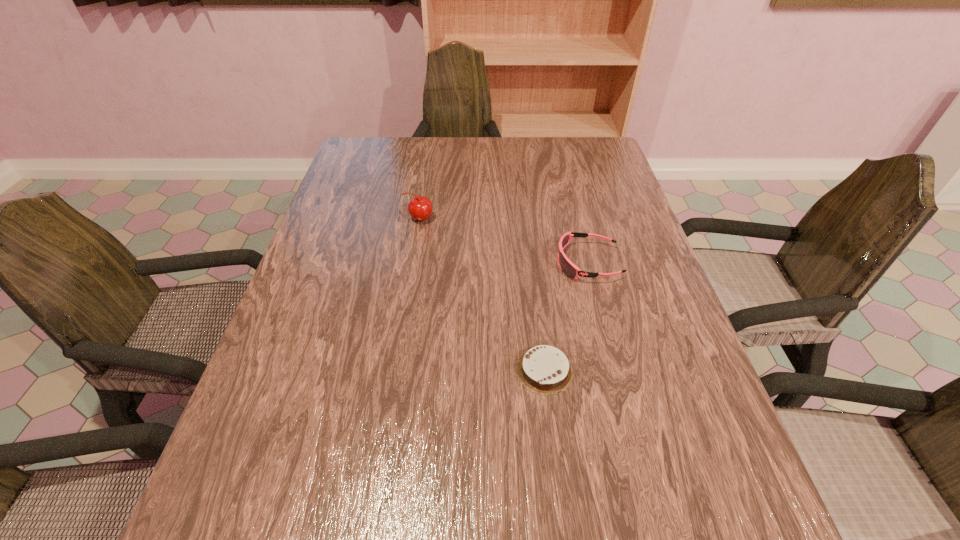
Find the location of a particular element. free space located 0.300m on the left of the chocolate cake is located at coordinates click(x=362, y=370).

The height and width of the screenshot is (540, 960). I want to click on object positioned at the right edge, so point(568,268).

The image size is (960, 540). In the image, there is a desktop. What are the coordinates of `vacant space at the far edge` in the screenshot? It's located at (555, 167).

Locate an element on the screen. The height and width of the screenshot is (540, 960). free space at the left edge of the desktop is located at coordinates (358, 234).

Image resolution: width=960 pixels, height=540 pixels. What are the coordinates of `vacant space at the right edge of the desktop` in the screenshot? It's located at coord(717,498).

I want to click on vacant area between the second object from left to right and the goggles, so click(566, 316).

In order to click on vacant space that is in between the chocolate cake and the second nearest object in this screenshot , I will do `click(566, 316)`.

At what (x,y) coordinates should I click in order to perform the action: click on unoccupied area between the farthest object and the second object from left to right. Please return your answer as a coordinate pair (x, y). Image resolution: width=960 pixels, height=540 pixels. Looking at the image, I should click on (482, 294).

Where is `free spot between the second farthest object and the chocolate cake`? free spot between the second farthest object and the chocolate cake is located at coordinates (566, 316).

You are a GUI agent. You are given a task and a screenshot of the screen. Output one action in this format:
    pyautogui.click(x=<x>, y=<y>)
    Task: Click on the free area in between the tallest object and the second shortest object
    
    Given the screenshot: What is the action you would take?
    pyautogui.click(x=503, y=241)